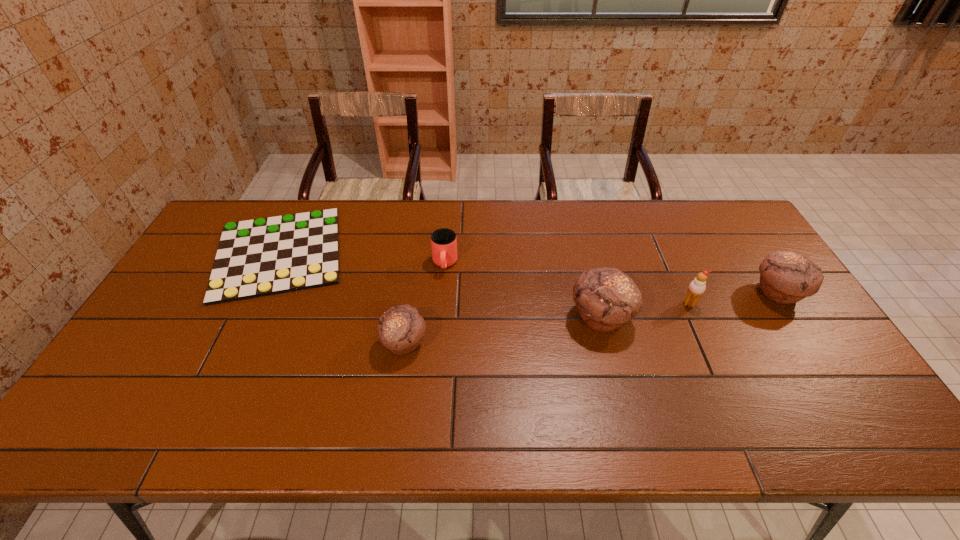
The height and width of the screenshot is (540, 960). I want to click on the shortest muffin, so click(x=401, y=328).

Locate an element on the screen. the second muffin from left to right is located at coordinates (606, 298).

Where is `the second shortest muffin`? This screenshot has width=960, height=540. the second shortest muffin is located at coordinates (786, 277).

Identify the location of the rightmost object. (786, 277).

Where is `the leftmost object`? The width and height of the screenshot is (960, 540). the leftmost object is located at coordinates (265, 256).

The width and height of the screenshot is (960, 540). Find the location of `the shortest object`. the shortest object is located at coordinates (265, 256).

The image size is (960, 540). Identify the location of icecream. (697, 287).

I want to click on cup, so click(443, 241).

You are a GUI agent. You are given a task and a screenshot of the screen. Output one action in this format:
    pyautogui.click(x=<x>, y=<y>)
    Task: Click on the free location located 0.180m on the right of the leftmost muffin
    This screenshot has width=960, height=540.
    Given the screenshot: What is the action you would take?
    pyautogui.click(x=496, y=343)

This screenshot has width=960, height=540. Find the location of `vacant space located on the back of the third object from right to left`. vacant space located on the back of the third object from right to left is located at coordinates (579, 231).